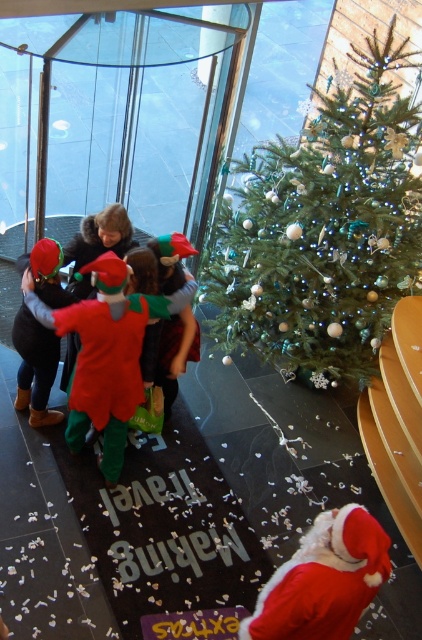
Based on the photo, you are planning to place a new decoration on the larger object between the green matte christmas tree at upper right and the shiny red fabric elf at center. Which object should you choose?

The green matte christmas tree at upper right has a larger size compared to the shiny red fabric elf at center, so you should place the new decoration on the green matte christmas tree at upper right.

You are standing in the festive scene and want to reach a specific point to place a decoration. The point is located at coordinates point (329,148). Given that you are currently 5 meters away from this point, can you move closer to it?

The distance of point (329,148) from viewer is 4.27 meters. Since you are currently 5 meters away, you can move closer to reduce the distance to 4.27 meters.

You are standing in the festive scene and want to find the shiny red fabric elf at center. According to the coordinates provided, where should you look relative to the Christmas tree?

The shiny red fabric elf at center is located at coordinates point (x=105, y=353), which means it is positioned to the right and slightly above the center of the image. Since the Christmas tree is near the staircase, the elf is likely placed to the right side of the tree in the scene.